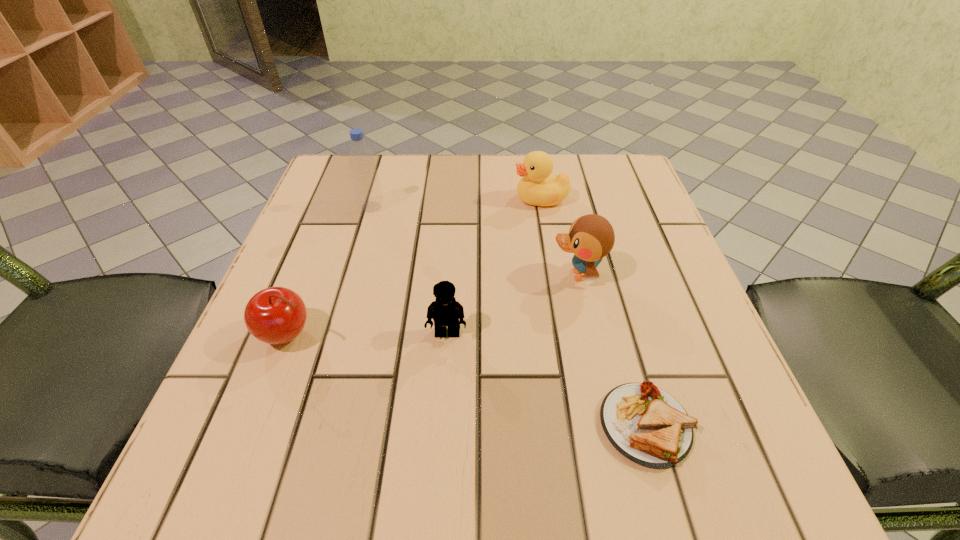
Locate an element on the screen. The width and height of the screenshot is (960, 540). vacant point located between the sandwich and the cherry is located at coordinates (467, 380).

Find the location of `vacant area that lies between the fourth object from right to left and the bottle`. vacant area that lies between the fourth object from right to left and the bottle is located at coordinates (409, 271).

Point out which object is positioned as the third nearest to the farther duck. Please provide its 2D coordinates. Your answer should be formatted as a tuple, i.e. [(x, y)], where the tuple contains the x and y coordinates of a point satisfying the conditions above.

[(445, 311)]

I want to click on the fifth closest object to the Lego, so click(x=537, y=187).

You are a GUI agent. You are given a task and a screenshot of the screen. Output one action in this format:
    pyautogui.click(x=<x>, y=<y>)
    Task: Click on the blank space that satisfies the following two spatial constraints: 1. at the beak of the nearest object; 2. on the right side of the farther duck
    This screenshot has width=960, height=540.
    Given the screenshot: What is the action you would take?
    pyautogui.click(x=578, y=425)

At what (x,y) coordinates should I click in order to perform the action: click on free space in the image that satisfies the following two spatial constraints: 1. at the beak of the shortest object; 2. on the right side of the farther duck. Please return your answer as a coordinate pair (x, y). The height and width of the screenshot is (540, 960). Looking at the image, I should click on (578, 425).

Image resolution: width=960 pixels, height=540 pixels. What are the coordinates of `blank space that satisfies the following two spatial constraints: 1. on the front-facing side of the third farthest object; 2. on the front-facing side of the Lego` in the screenshot? It's located at (590, 333).

Where is `vacant space that satisfies the following two spatial constraints: 1. on the front side of the nearest object; 2. on the left side of the tallest object`? The image size is (960, 540). vacant space that satisfies the following two spatial constraints: 1. on the front side of the nearest object; 2. on the left side of the tallest object is located at coordinates (308, 425).

Where is `vacant space that satisfies the following two spatial constraints: 1. on the front-facing side of the nearest object; 2. on the left side of the nearer duck`? The height and width of the screenshot is (540, 960). vacant space that satisfies the following two spatial constraints: 1. on the front-facing side of the nearest object; 2. on the left side of the nearer duck is located at coordinates (611, 425).